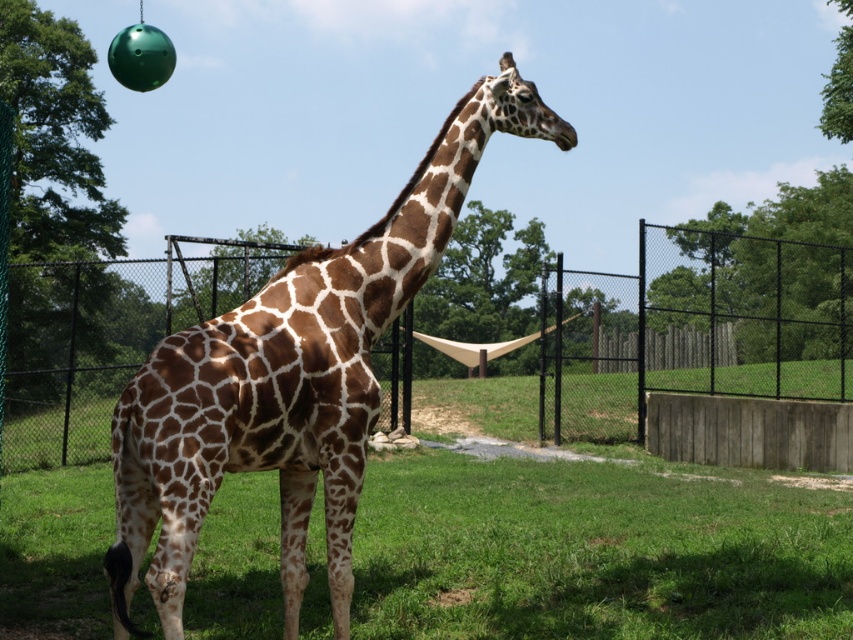
Which is more to the left, black metal fence at center or brown spotted giraffe at center?

From the viewer's perspective, brown spotted giraffe at center appears more on the left side.

Who is positioned more to the right, black metal fence at center or brown spotted giraffe at center?

Positioned to the right is black metal fence at center.

Who is more distant from viewer, (491, 284) or (335, 564)?

The point (491, 284) is more distant.

Where is `black metal fence at center`? black metal fence at center is located at coordinates (637, 324).